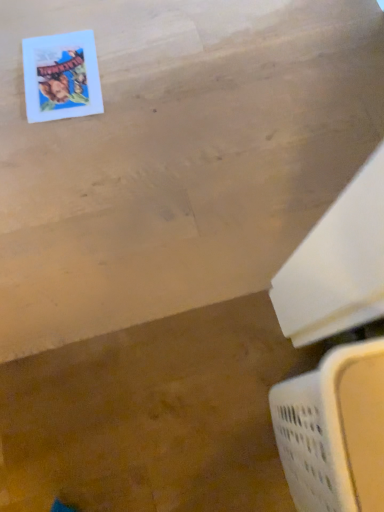
What do you see at coordinates (61, 76) in the screenshot? I see `matte paper comic book at upper left` at bounding box center [61, 76].

What is the approximate width of matte paper comic book at upper left?

It is 31.17 centimeters.

Where is `matte paper comic book at upper left`? This screenshot has height=512, width=384. matte paper comic book at upper left is located at coordinates (61, 76).

Describe the element at coordinates (334, 431) in the screenshot. I see `white plastic laundry basket at lower right` at that location.

Identify the location of white plastic laundry basket at lower right. Image resolution: width=384 pixels, height=512 pixels. (334, 431).

Measure the distance between point (335, 349) and camera.

The depth of point (335, 349) is 35.00 inches.

In order to face white plastic laundry basket at lower right, should I rotate leftwards or rightwards?

To align with it, rotate right about 24.306°.

Locate an element on the screen. matte paper comic book at upper left is located at coordinates (61, 76).

From the picture: Between white plastic laundry basket at lower right and matte paper comic book at upper left, which one appears on the right side from the viewer's perspective?

white plastic laundry basket at lower right is more to the right.

Considering the positions of objects white plastic laundry basket at lower right and matte paper comic book at upper left in the image provided, who is behind, white plastic laundry basket at lower right or matte paper comic book at upper left?

matte paper comic book at upper left is behind.

Considering the positions of point (295, 403) and point (84, 89), is point (295, 403) closer or farther from the camera than point (84, 89)?

Point (295, 403).

From the image's perspective, between white plastic laundry basket at lower right and matte paper comic book at upper left, who is located below?

white plastic laundry basket at lower right is shown below in the image.

From a real-world perspective, which is physically below, white plastic laundry basket at lower right or matte paper comic book at upper left?

matte paper comic book at upper left is physically lower.

Can you confirm if white plastic laundry basket at lower right is wider than matte paper comic book at upper left?

Correct, the width of white plastic laundry basket at lower right exceeds that of matte paper comic book at upper left.

From their relative heights in the image, would you say white plastic laundry basket at lower right is taller or shorter than matte paper comic book at upper left?

In the image, white plastic laundry basket at lower right appears to be taller than matte paper comic book at upper left.

Can you confirm if white plastic laundry basket at lower right is bigger than matte paper comic book at upper left?

Correct, white plastic laundry basket at lower right is larger in size than matte paper comic book at upper left.

Choose the correct answer: Is white plastic laundry basket at lower right inside matte paper comic book at upper left or outside it?

white plastic laundry basket at lower right cannot be found inside matte paper comic book at upper left.

Is there a large distance between white plastic laundry basket at lower right and matte paper comic book at upper left?

white plastic laundry basket at lower right is far away from matte paper comic book at upper left.

Is white plastic laundry basket at lower right aimed at matte paper comic book at upper left?

No, white plastic laundry basket at lower right is not oriented towards matte paper comic book at upper left.

How many degrees apart are the facing directions of white plastic laundry basket at lower right and matte paper comic book at upper left?

There is a 93.7-degree angle between the facing directions of white plastic laundry basket at lower right and matte paper comic book at upper left.

Measure the distance between white plastic laundry basket at lower right and matte paper comic book at upper left.

The distance of white plastic laundry basket at lower right from matte paper comic book at upper left is 1.01 meters.

Locate an element on the screen. laundry basket above the matte paper comic book at upper left (from a real-world perspective) is located at coordinates (334, 431).

Considering the positions of objects matte paper comic book at upper left and white plastic laundry basket at lower right in the image provided, who is more to the right, matte paper comic book at upper left or white plastic laundry basket at lower right?

Positioned to the right is white plastic laundry basket at lower right.

Which is behind, matte paper comic book at upper left or white plastic laundry basket at lower right?

matte paper comic book at upper left is further from the camera.

Considering the points (102, 105) and (382, 366), which point is in front, point (102, 105) or point (382, 366)?

Positioned in front is point (382, 366).

Consider the image. From the image's perspective, between matte paper comic book at upper left and white plastic laundry basket at lower right, who is located below?

From the image's view, white plastic laundry basket at lower right is below.

From a real-world perspective, which is physically below, matte paper comic book at upper left or white plastic laundry basket at lower right?

From a 3D spatial view, matte paper comic book at upper left is below.

In terms of width, does matte paper comic book at upper left look wider or thinner when compared to white plastic laundry basket at lower right?

In the image, matte paper comic book at upper left appears to be more narrow than white plastic laundry basket at lower right.

Which of these two, matte paper comic book at upper left or white plastic laundry basket at lower right, stands shorter?

With less height is matte paper comic book at upper left.

Consider the image. Between matte paper comic book at upper left and white plastic laundry basket at lower right, which one has smaller size?

With smaller size is matte paper comic book at upper left.

Is white plastic laundry basket at lower right surrounded by matte paper comic book at upper left?

No, matte paper comic book at upper left does not contain white plastic laundry basket at lower right.

Are matte paper comic book at upper left and white plastic laundry basket at lower right beside each other?

No.

In the scene shown: Is matte paper comic book at upper left oriented towards white plastic laundry basket at lower right?

No, matte paper comic book at upper left is not turned towards white plastic laundry basket at lower right.

How distant is matte paper comic book at upper left from white plastic laundry basket at lower right?

A distance of 1.01 meters exists between matte paper comic book at upper left and white plastic laundry basket at lower right.

At what (x,y) coordinates should I click in order to perform the action: click on comic book on the left of the white plastic laundry basket at lower right. Please return your answer as a coordinate pair (x, y). Looking at the image, I should click on (61, 76).

Image resolution: width=384 pixels, height=512 pixels. I want to click on comic book that is on the left side of white plastic laundry basket at lower right, so click(61, 76).

In order to click on comic book beneath the white plastic laundry basket at lower right (from a real-world perspective) in this screenshot , I will do (61, 76).